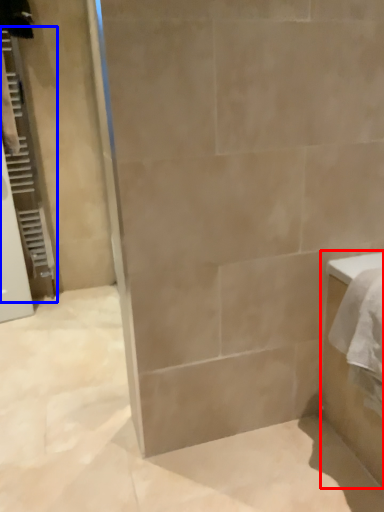
Question: Which object is further to the camera taking this photo, bathroom cabinet (highlighted by a red box) or screen door (highlighted by a blue box)?

Choices:
 (A) bathroom cabinet
 (B) screen door

Answer: (B)